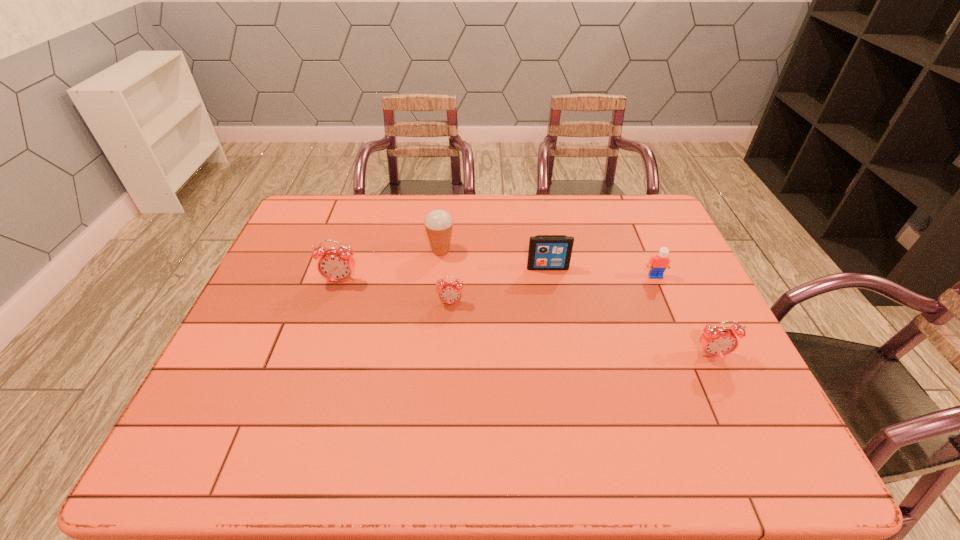
If the aim is uniform spacing by inserting an additional alarm_clock among them, please point to a vacant space for this new alarm_clock. Please provide its 2D coordinates. Your answer should be formatted as a tuple, i.e. [(x, y)], where the tuple contains the x and y coordinates of a point satisfying the conditions above.

[(574, 328)]